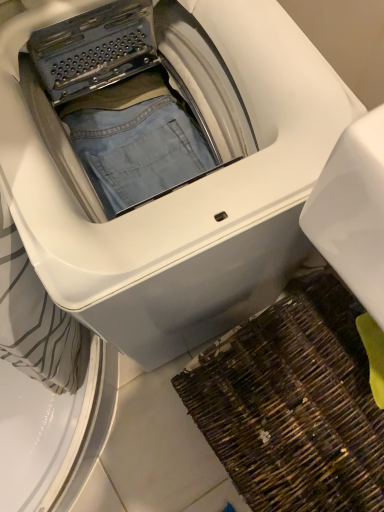
Locate an element on the screen. Image resolution: width=384 pixels, height=512 pixels. white glossy washing machine at center is located at coordinates (179, 185).

The width and height of the screenshot is (384, 512). What do you see at coordinates (179, 185) in the screenshot? I see `white glossy washing machine at center` at bounding box center [179, 185].

In order to face brown woven mat at lower right, should I rotate leftwards or rightwards?

To face it directly, rotate right by 14.583 degrees.

Measure the distance between point (347,414) and camera.

They are 26.02 inches apart.

The height and width of the screenshot is (512, 384). Identify the location of brown woven mat at lower right. (293, 404).

This screenshot has width=384, height=512. What do you see at coordinates (293, 404) in the screenshot? I see `brown woven mat at lower right` at bounding box center [293, 404].

You are a GUI agent. You are given a task and a screenshot of the screen. Output one action in this format:
    pyautogui.click(x=<x>, y=<y>)
    Task: Click on the white glossy washing machine at center
    The height and width of the screenshot is (512, 384).
    Given the screenshot: What is the action you would take?
    pyautogui.click(x=179, y=185)

Would you say white glossy washing machine at center is to the left or to the right of brown woven mat at lower right in the picture?

Based on their positions, white glossy washing machine at center is located to the left of brown woven mat at lower right.

Considering the relative positions of white glossy washing machine at center and brown woven mat at lower right in the image provided, is white glossy washing machine at center in front of brown woven mat at lower right?

Yes, white glossy washing machine at center is in front of brown woven mat at lower right.

Considering the points (239, 118) and (332, 328), which point is behind, point (239, 118) or point (332, 328)?

The point (332, 328) is behind.

From the image's perspective, is white glossy washing machine at center located above or below brown woven mat at lower right?

Based on their image positions, white glossy washing machine at center is located above brown woven mat at lower right.

From a real-world perspective, which object stands above the other?

white glossy washing machine at center.

Can you confirm if white glossy washing machine at center is thinner than brown woven mat at lower right?

No.

Who is shorter, white glossy washing machine at center or brown woven mat at lower right?

With less height is brown woven mat at lower right.

Who is smaller, white glossy washing machine at center or brown woven mat at lower right?

With smaller size is brown woven mat at lower right.

Is brown woven mat at lower right inside white glossy washing machine at center?

No, white glossy washing machine at center does not contain brown woven mat at lower right.

Is white glossy washing machine at center in contact with brown woven mat at lower right?

white glossy washing machine at center and brown woven mat at lower right are clearly separated.

Consider the image. Could you tell me if white glossy washing machine at center is turned towards brown woven mat at lower right?

Yes, white glossy washing machine at center is turned towards brown woven mat at lower right.

This screenshot has width=384, height=512. In order to click on doormat behind the white glossy washing machine at center in this screenshot , I will do `click(293, 404)`.

Which is more to the right, brown woven mat at lower right or white glossy washing machine at center?

Positioned to the right is brown woven mat at lower right.

Considering their positions, is brown woven mat at lower right located in front of or behind white glossy washing machine at center?

Visually, brown woven mat at lower right is located behind white glossy washing machine at center.

Does point (305, 403) lie in front of point (19, 211)?

No, (305, 403) is further to viewer.

From the image's perspective, is brown woven mat at lower right above white glossy washing machine at center?

No.

From a real-world perspective, is brown woven mat at lower right physically below white glossy washing machine at center?

Indeed, from a real-world perspective, brown woven mat at lower right is positioned beneath white glossy washing machine at center.

Is brown woven mat at lower right thinner than white glossy washing machine at center?

Correct, the width of brown woven mat at lower right is less than that of white glossy washing machine at center.

Considering the relative sizes of brown woven mat at lower right and white glossy washing machine at center in the image provided, is brown woven mat at lower right shorter than white glossy washing machine at center?

Correct, brown woven mat at lower right is not as tall as white glossy washing machine at center.

Considering the relative sizes of brown woven mat at lower right and white glossy washing machine at center in the image provided, is brown woven mat at lower right smaller than white glossy washing machine at center?

Yes.

Would you say brown woven mat at lower right is outside white glossy washing machine at center?

Yes, brown woven mat at lower right is located beyond the bounds of white glossy washing machine at center.

Is brown woven mat at lower right next to white glossy washing machine at center?

No, brown woven mat at lower right is not in contact with white glossy washing machine at center.

Could you tell me if brown woven mat at lower right is turned towards white glossy washing machine at center?

No, brown woven mat at lower right is not aimed at white glossy washing machine at center.

Can you tell me how much brown woven mat at lower right and white glossy washing machine at center differ in facing direction?

There is a 85.8-degree angle between the facing directions of brown woven mat at lower right and white glossy washing machine at center.

The width and height of the screenshot is (384, 512). What are the coordinates of `doormat located below the white glossy washing machine at center (from the image's perspective)` in the screenshot? It's located at (293, 404).

Where is `washing machine in front of the brown woven mat at lower right`? washing machine in front of the brown woven mat at lower right is located at coordinates (179, 185).

Identify the location of washing machine above the brown woven mat at lower right (from a real-world perspective). Image resolution: width=384 pixels, height=512 pixels. (179, 185).